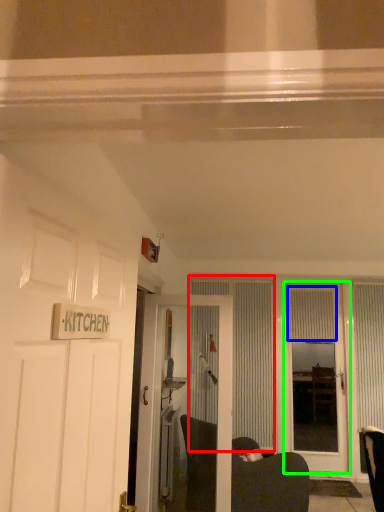
Question: Estimate the real-world distances between objects in this image. Which object is farther from curtain (highlighted by a red box), curtain (highlighted by a blue box) or door (highlighted by a green box)?

Choices:
 (A) curtain
 (B) door

Answer: (A)